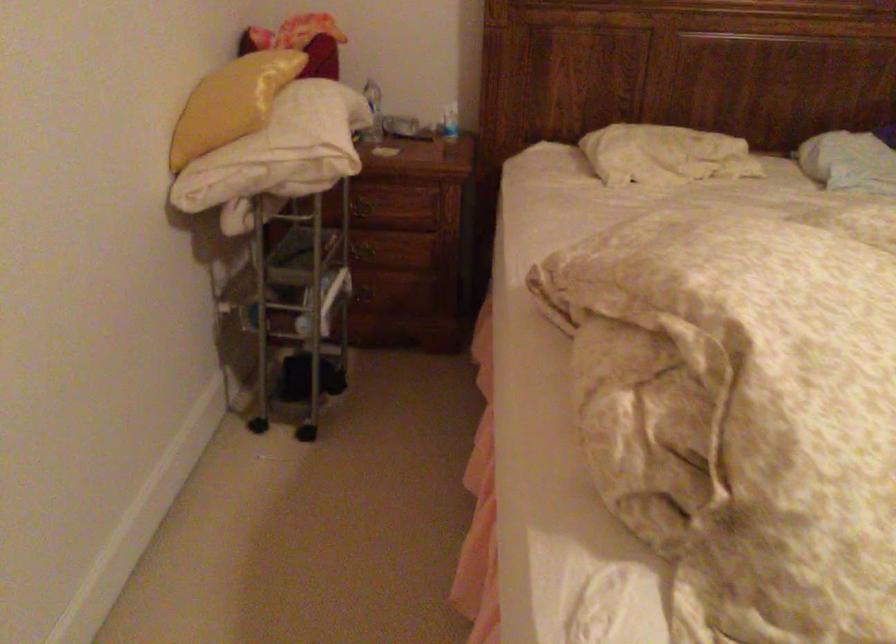
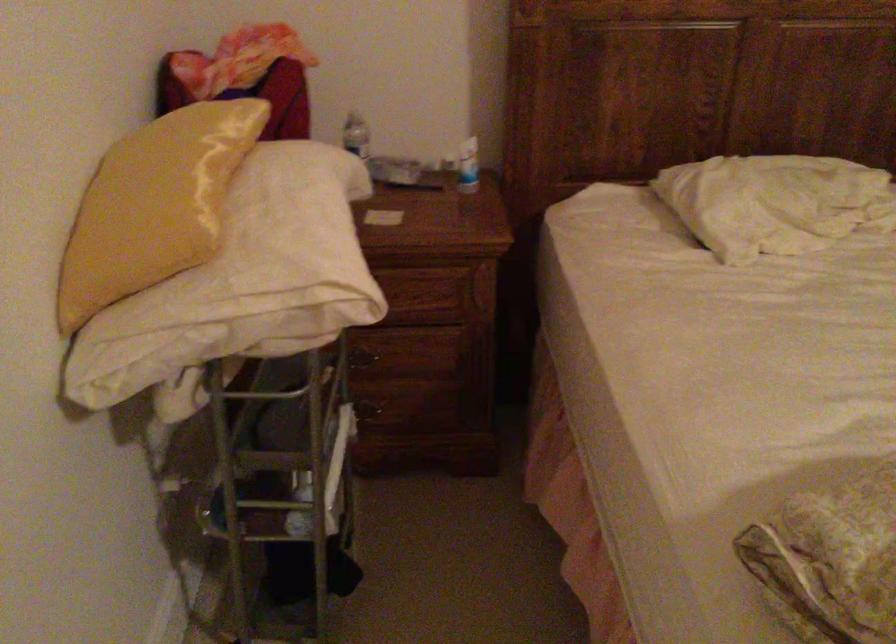
Where in the second image is the point corresponding to (233,98) from the first image?

(153, 205)